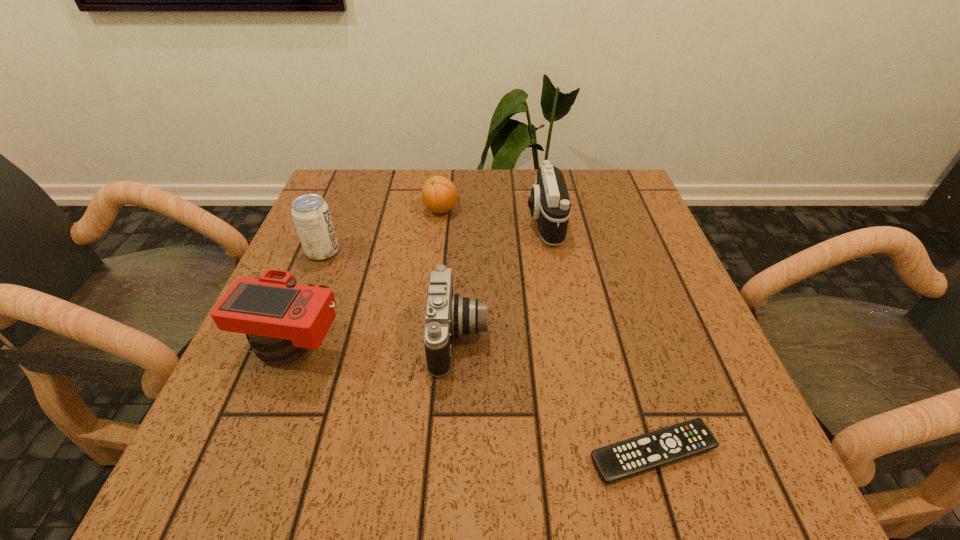
This screenshot has height=540, width=960. Find the location of `vacant area in the image that satisfies the following two spatial constraints: 1. on the front lens of the farthest camera; 2. on the front side of the soda can`. vacant area in the image that satisfies the following two spatial constraints: 1. on the front lens of the farthest camera; 2. on the front side of the soda can is located at coordinates (550, 252).

Identify the location of free spot that satisfies the following two spatial constraints: 1. on the front-facing side of the second camera from left to right; 2. on the right side of the shortest object. (453, 453).